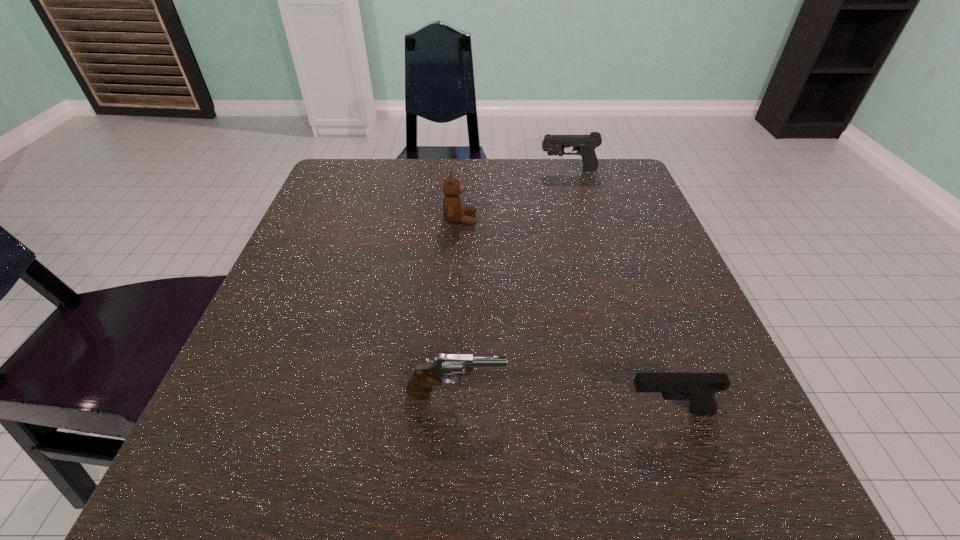
Image resolution: width=960 pixels, height=540 pixels. In order to click on the third nearest object in this screenshot , I will do `click(453, 211)`.

Where is `the farthest object`? the farthest object is located at coordinates tap(585, 145).

Identify the location of the second nearest object. (419, 386).

What are the coordinates of `the leftmost pistol` in the screenshot? It's located at (419, 386).

Where is `the nearest object`? The height and width of the screenshot is (540, 960). the nearest object is located at coordinates (699, 388).

Where is `free space located 0.060m at the face of the teddy bear`? This screenshot has height=540, width=960. free space located 0.060m at the face of the teddy bear is located at coordinates (505, 220).

This screenshot has height=540, width=960. I want to click on vacant area situated at the barrel of the farthest object, so click(438, 171).

The width and height of the screenshot is (960, 540). In order to click on vacant area situated 0.380m at the barrel of the farthest object in this screenshot , I will do `click(385, 171)`.

The width and height of the screenshot is (960, 540). Identify the location of free space located at the barrel of the farthest object. (450, 171).

The image size is (960, 540). What are the coordinates of `free space located 0.330m at the barrel of the second nearest pistol` in the screenshot? It's located at (737, 394).